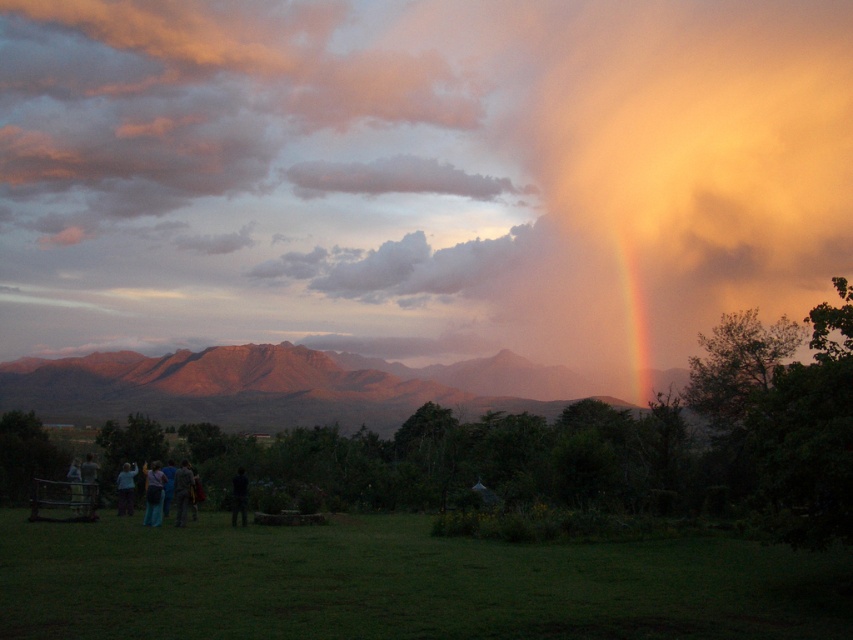
You are standing at the camera position and want to take a photo of the rustic brown mountains at center. Considering the mountains are 40.35 meters away, will they appear sharp in your photo if your camera has a maximum focusing distance of 45 meters?

The rustic brown mountains at center are 40.35 meters away from the camera, which is within the camera maximum focusing distance of 45 meters. Therefore, the mountains will appear sharp in the photo.

You are a photographer trying to capture the rainbow at upper center and the dark fabric jacket at lower left in the same frame. Considering their sizes, which object should you focus on first to ensure both are visible in the photo?

The rainbow at upper center is larger in size than the dark fabric jacket at lower left, so you should focus on the rainbow at upper center first to ensure both fit in the frame.